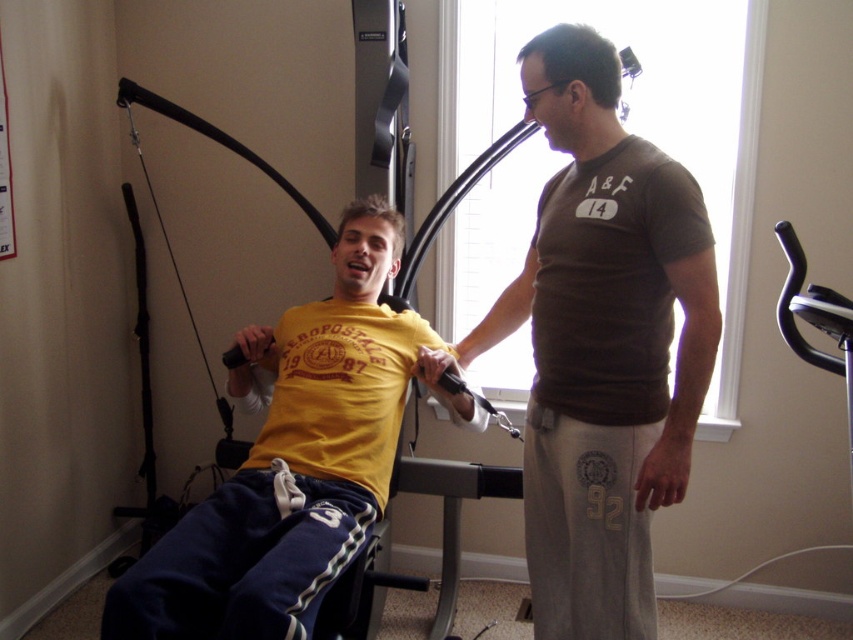
Question: Is brown cotton t-shirt at center above yellow matte t-shirt at center?

Choices:
 (A) yes
 (B) no

Answer: (A)

Question: Can you confirm if brown cotton t-shirt at center is positioned to the left of yellow matte t-shirt at center?

Choices:
 (A) yes
 (B) no

Answer: (B)

Question: Which object appears closest to the camera in this image?

Choices:
 (A) yellow matte t-shirt at center
 (B) brown cotton t-shirt at center

Answer: (A)

Question: Does brown cotton t-shirt at center lie behind yellow matte t-shirt at center?

Choices:
 (A) yes
 (B) no

Answer: (A)